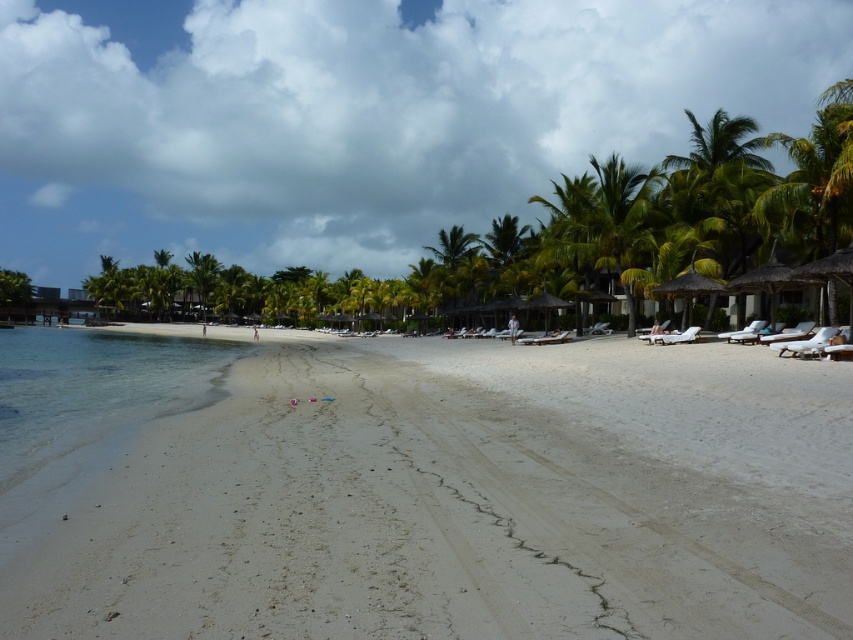
Between white sandy beach at center and clear water at lower left, which one has more height?

clear water at lower left is taller.

Between white sandy beach at center and clear water at lower left, which one is positioned higher?

clear water at lower left

Measure the distance between white sandy beach at center and camera.

white sandy beach at center and camera are 13.76 feet apart from each other.

You are a GUI agent. You are given a task and a screenshot of the screen. Output one action in this format:
    pyautogui.click(x=<x>, y=<y>)
    Task: Click on the white sandy beach at center
    Image resolution: width=853 pixels, height=640 pixels.
    Given the screenshot: What is the action you would take?
    pyautogui.click(x=467, y=500)